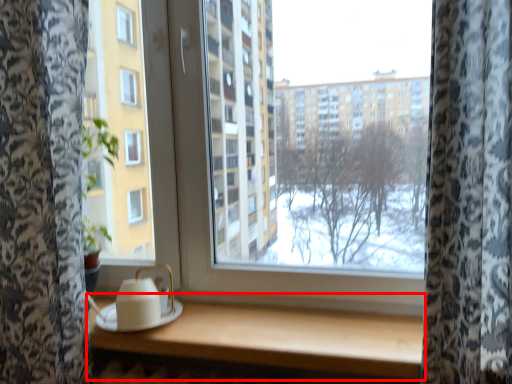
Question: From the image's perspective, where is table (annotated by the red box) located relative to tea set?

Choices:
 (A) below
 (B) above

Answer: (A)